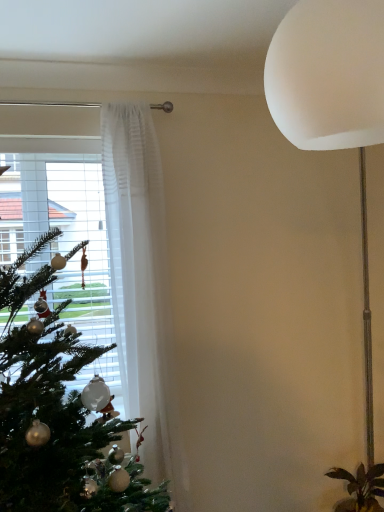
I want to click on green leafy plant at lower right, so click(x=361, y=488).

Describe the element at coordinates (361, 488) in the screenshot. I see `green leafy plant at lower right` at that location.

Locate an element on the screen. Image resolution: width=384 pixels, height=512 pixels. green leafy plant at lower right is located at coordinates (361, 488).